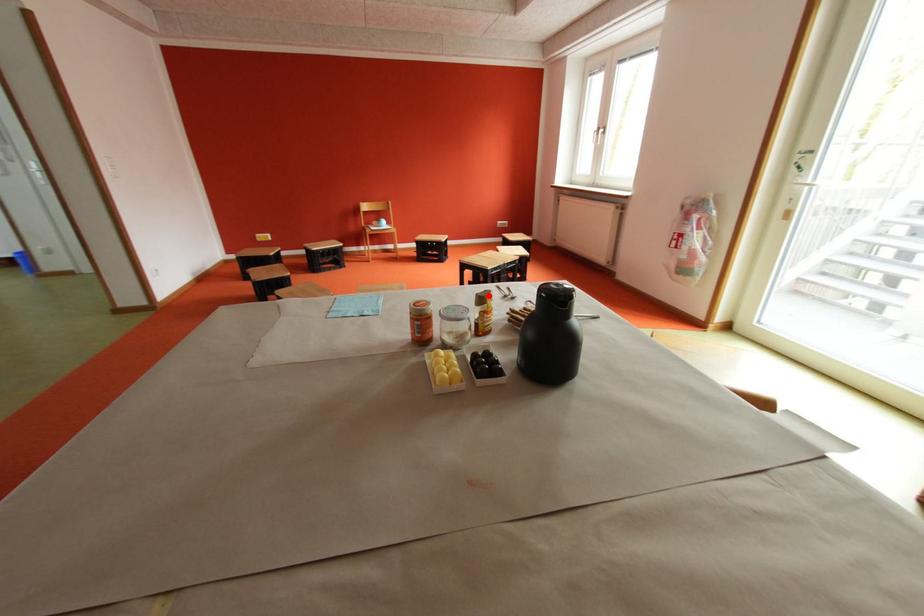
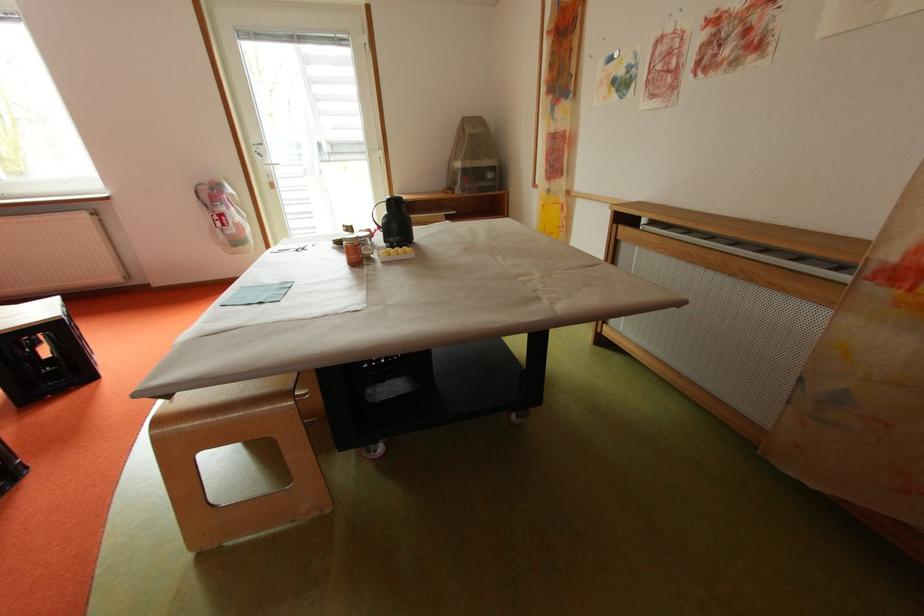
Question: I am providing you with two images of the same scene from different viewpoints. A red point is marked on the first image. Can you still see the location of the red point in image 2?

Choices:
 (A) Yes
 (B) No

Answer: (B)